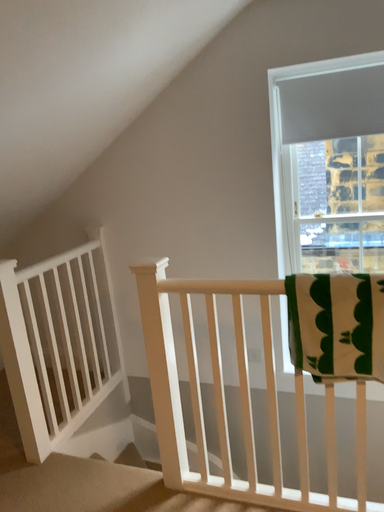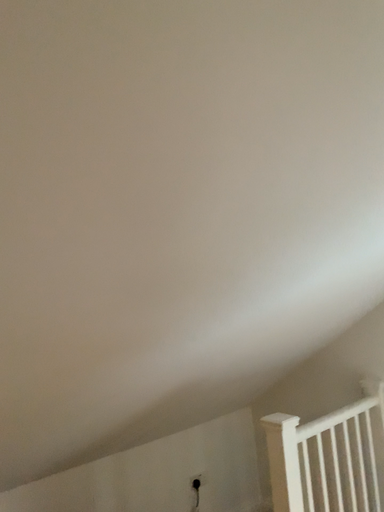
Question: Which way did the camera rotate in the video?

Choices:
 (A) rotated left
 (B) rotated right

Answer: (A)